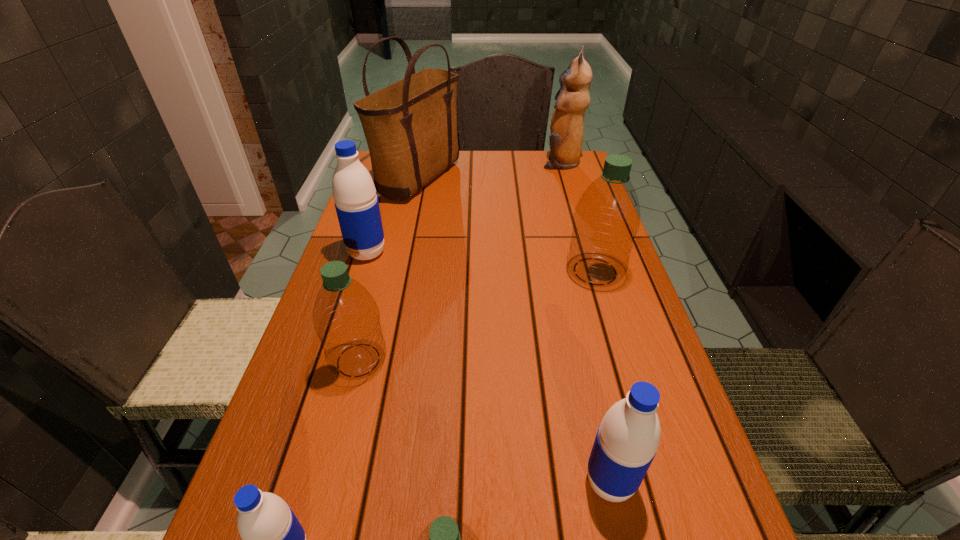
You are a GUI agent. You are given a task and a screenshot of the screen. Output one action in this format:
    pyautogui.click(x=<x>, y=<y>)
    Task: Click on the object that is the sixth nearest to the third nearest water bottle
    The width and height of the screenshot is (960, 540).
    Given the screenshot: What is the action you would take?
    pyautogui.click(x=410, y=126)

Select which object is the seventh closest to the biggest blue water bottle. Please provide its 2D coordinates. Your answer should be formatted as a tuple, i.e. [(x, y)], where the tuple contains the x and y coordinates of a point satisfying the conditions above.

[(446, 539)]

Select which water bottle is the fifth closest to the smallest green water bottle. Please provide its 2D coordinates. Your answer should be formatted as a tuple, i.e. [(x, y)], where the tuple contains the x and y coordinates of a point satisfying the conditions above.

[(356, 203)]

What are the coordinates of `the fifth closest water bottle to the nearest blue water bottle` in the screenshot? It's located at (606, 219).

Identify which blue water bottle is located as the second nearest to the second farthest blue water bottle. Please provide its 2D coordinates. Your answer should be formatted as a tuple, i.e. [(x, y)], where the tuple contains the x and y coordinates of a point satisfying the conditions above.

[(356, 203)]

Point out which blue water bottle is positioned as the third nearest to the tote bag. Please provide its 2D coordinates. Your answer should be formatted as a tuple, i.e. [(x, y)], where the tuple contains the x and y coordinates of a point satisfying the conditions above.

[(273, 539)]

The width and height of the screenshot is (960, 540). In order to click on green water bottle that is the closest one to the cat in this screenshot , I will do `click(606, 219)`.

Identify which green water bottle is the nearest to the fourth nearest object. Please provide its 2D coordinates. Your answer should be formatted as a tuple, i.e. [(x, y)], where the tuple contains the x and y coordinates of a point satisfying the conditions above.

[(446, 539)]

At what (x,y) coordinates should I click in order to perform the action: click on free space that satisfies the following two spatial constraints: 1. on the front side of the second biggest blue water bottle; 2. on the right side of the tote bag. Please return your answer as a coordinate pair (x, y). Looking at the image, I should click on (354, 482).

You are a GUI agent. You are given a task and a screenshot of the screen. Output one action in this format:
    pyautogui.click(x=<x>, y=<y>)
    Task: Click on the vacant region that satisfies the following two spatial constraints: 1. on the face of the farthest green water bottle; 2. on the right side of the cat
    This screenshot has width=960, height=540.
    Given the screenshot: What is the action you would take?
    point(593,271)